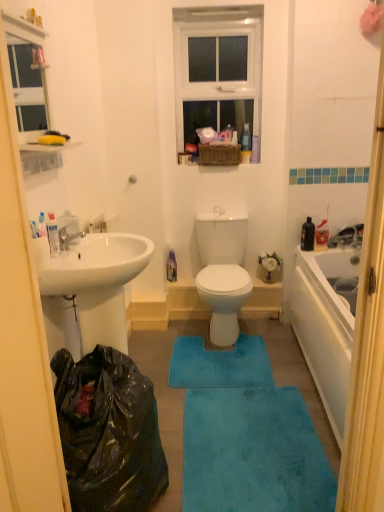
The image size is (384, 512). In order to click on unoccupied area in front of matte silver faucet at left in this screenshot , I will do `click(63, 258)`.